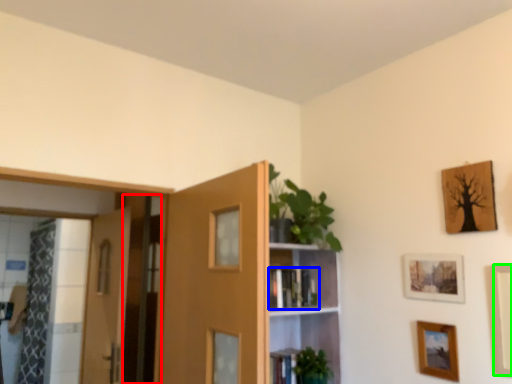
Question: Considering the real-world distances, which object is farthest from screen door (highlighted by a red box)? book (highlighted by a blue box) or picture frame (highlighted by a green box)?

Choices:
 (A) book
 (B) picture frame

Answer: (B)